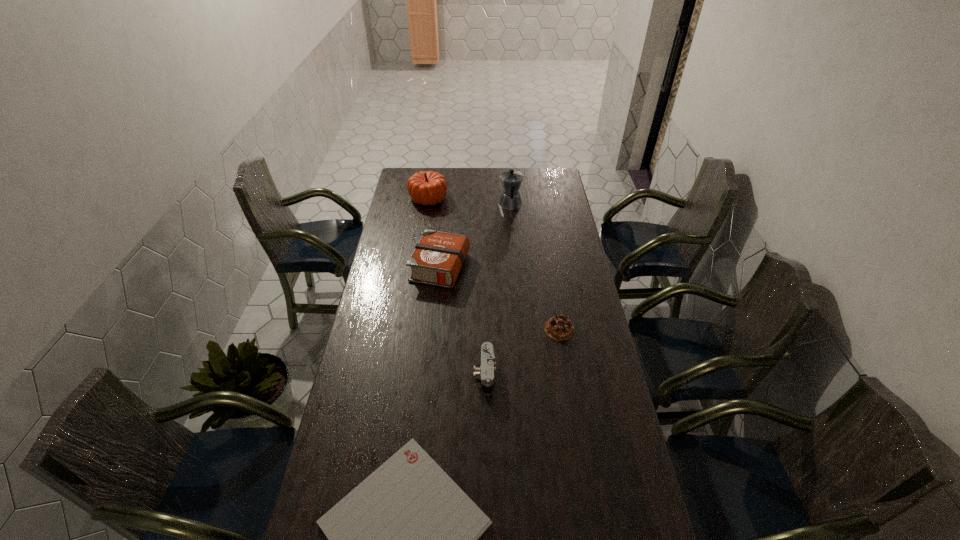
You are a GUI agent. You are given a task and a screenshot of the screen. Output one action in this format:
    pyautogui.click(x=<x>, y=<y>)
    Task: Click on the coffeepot
    This screenshot has width=960, height=540.
    Given the screenshot: What is the action you would take?
    pyautogui.click(x=511, y=180)

This screenshot has width=960, height=540. Identify the location of the tallest object. (511, 180).

I want to click on pumpkin, so click(x=426, y=187).

In order to click on the fourth nearest object in this screenshot , I will do `click(437, 259)`.

Find the location of a particular element. This screenshot has width=960, height=540. Bible is located at coordinates (437, 259).

Image resolution: width=960 pixels, height=540 pixels. I want to click on the second nearest object, so click(x=486, y=370).

Locate an element on the screen. This screenshot has height=540, width=960. camera is located at coordinates click(x=486, y=370).

I want to click on the rightmost object, so click(x=560, y=328).

Locate an element on the screen. the fourth farthest object is located at coordinates (560, 328).

I want to click on free space located at the spout of the tallest object, so click(508, 175).